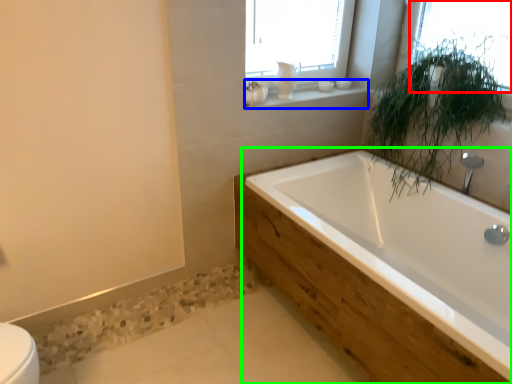
Question: Which is nearer to the window (highlighted by a red box)? window sill (highlighted by a blue box) or bathtub (highlighted by a green box).

Choices:
 (A) window sill
 (B) bathtub

Answer: (A)